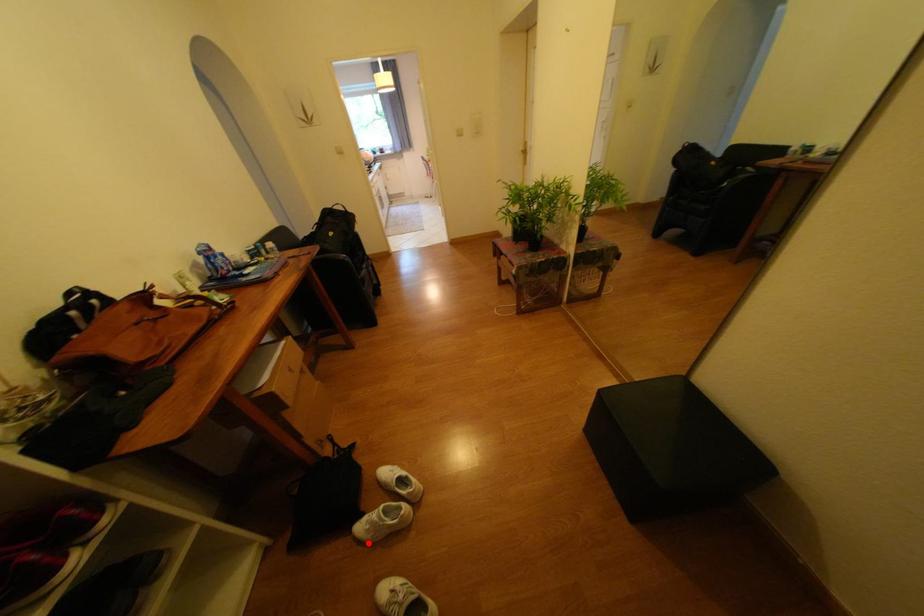
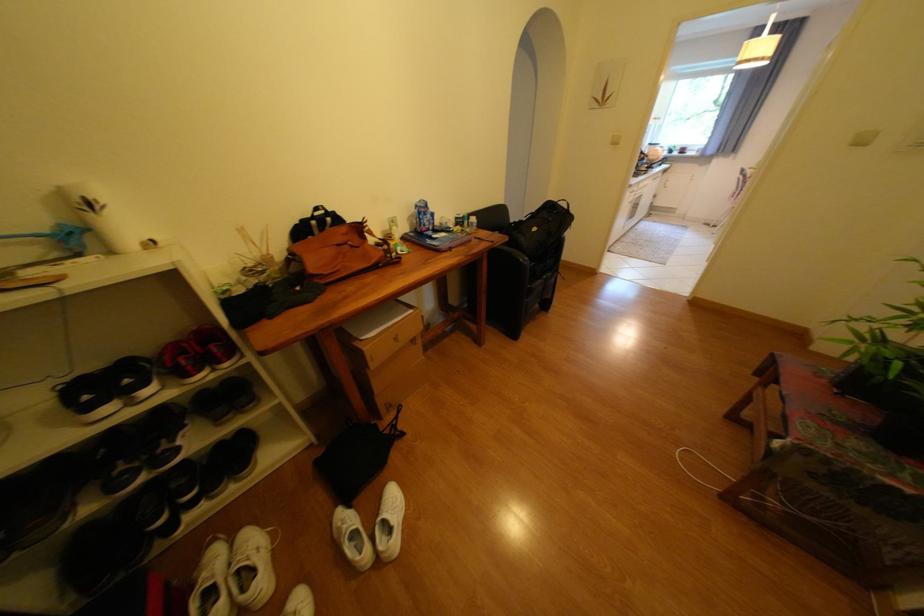
Question: I am providing you with two images of the same scene from different viewpoints. A red point is marked on the first image. Can you still see the location of the red point in image 2?

Choices:
 (A) Yes
 (B) No

Answer: (A)